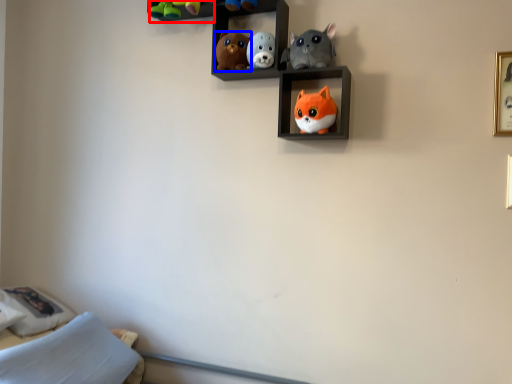
Question: Among these objects, which one is nearest to the camera, cabinet (highlighted by a red box) or toy (highlighted by a blue box)?

Choices:
 (A) cabinet
 (B) toy

Answer: (B)